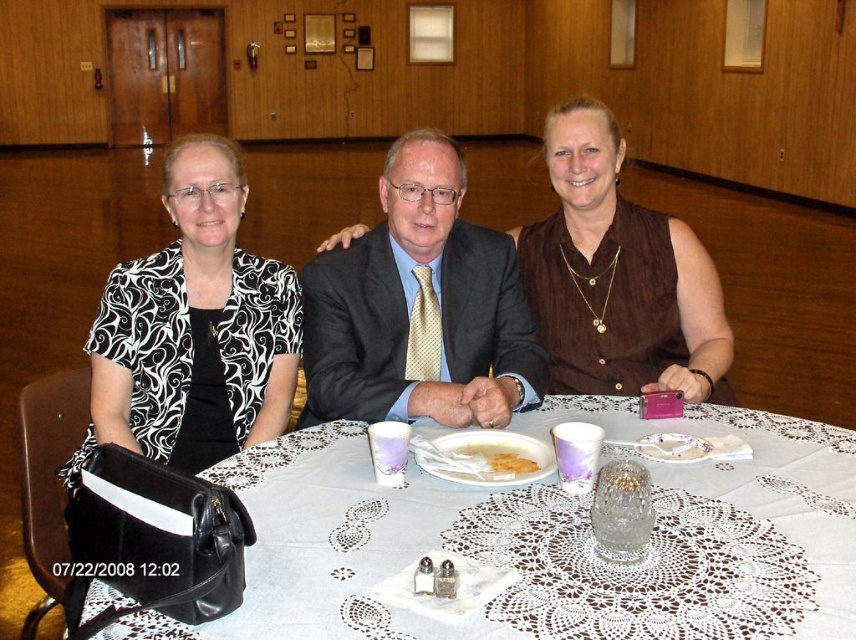
You are a guest at the table and want to reach for the yellow crumbly cake at center without moving the matte black suit at center. Is it possible to do so?

The yellow crumbly cake at center is behind the matte black suit at center, so you can reach it by moving around the side of the matte black suit at center without disturbing it.